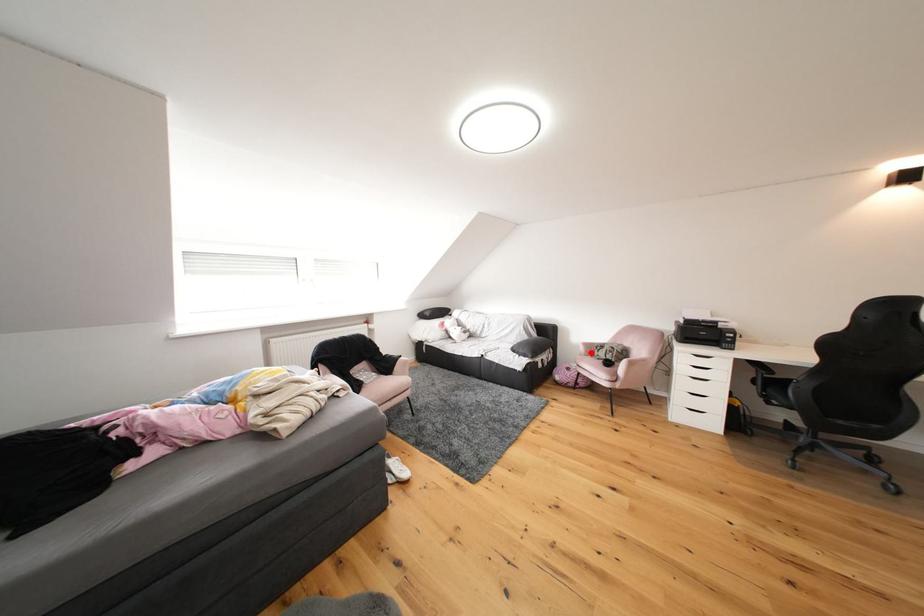
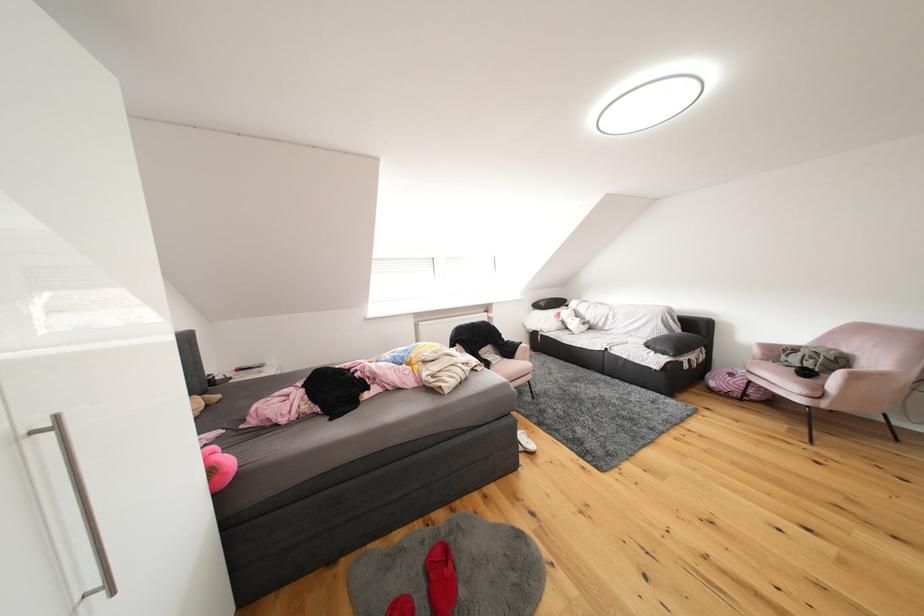
Locate, in the second image, the point that corresponds to the highlighted location in the first image.

(766, 355)